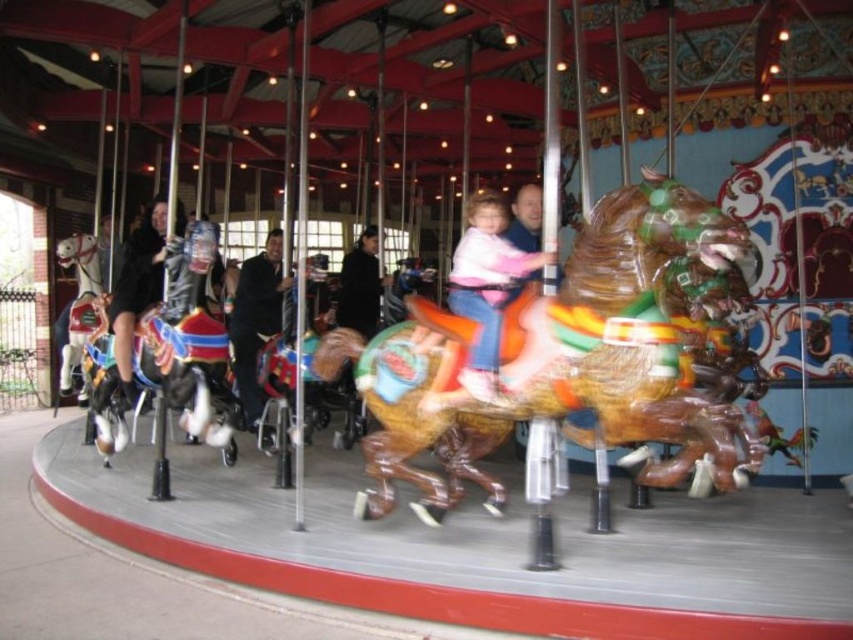
You are a parent trying to choose between two carousel horses for your child to ride. The shiny brown horse at center and the white glossy horse at left are both available. Based on their sizes, which horse would you recommend your child to ride?

The shiny brown horse at center is larger in size than the white glossy horse at left, so it would be more suitable for your child to ride the shiny brown horse at center as it provides a better fit for their size.

You are standing in front of the carousel and want to take a photo of the two points mentioned. Which point, point (582, 424) or point (62, 250), will appear larger in your camera view?

Point (582, 424) is closer to the camera than point (62, 250), so it will appear larger in the photo.

You are standing at the entrance of the carousel and want to locate the shiny brown horse at center. According to the coordinate system where the bottom left corner is the origin, what are its coordinates?

The shiny brown horse at center is located at coordinates approximately 0.555 on the x axis and 0.696 on the y axis.